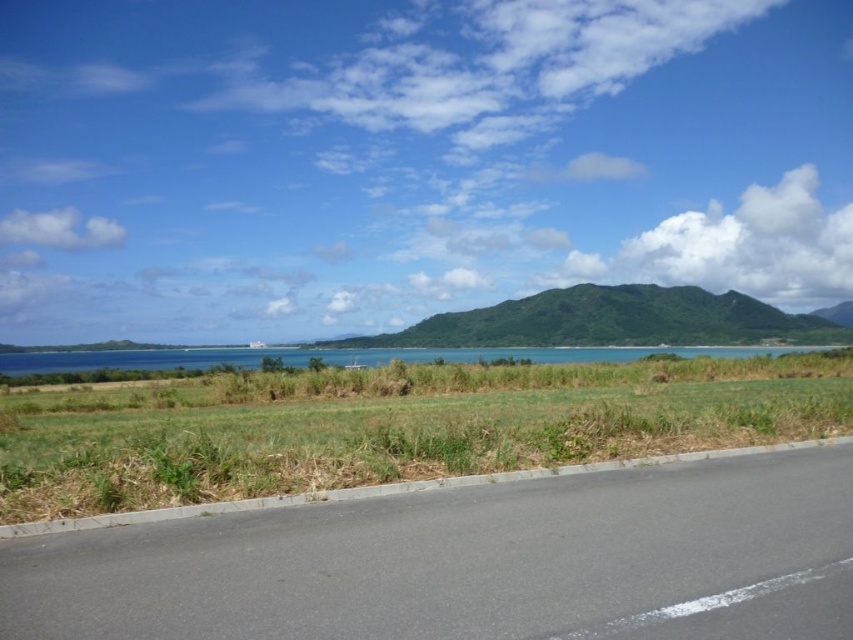
Question: Does green textured mountain at center have a smaller size compared to blue water at center?

Choices:
 (A) no
 (B) yes

Answer: (A)

Question: Does green textured mountain at center have a lesser width compared to blue water at center?

Choices:
 (A) yes
 (B) no

Answer: (A)

Question: Which object is the closest to the blue water at center?

Choices:
 (A) black asphalt highway at lower center
 (B) green textured mountain at center

Answer: (B)

Question: Considering the real-world distances, which object is farthest from the green textured mountain at center?

Choices:
 (A) black asphalt highway at lower center
 (B) blue water at center

Answer: (A)

Question: Is black asphalt highway at lower center above blue water at center?

Choices:
 (A) yes
 (B) no

Answer: (A)

Question: Which point is farther to the camera?

Choices:
 (A) (819, 518)
 (B) (474, 314)
 (C) (207, 362)

Answer: (B)